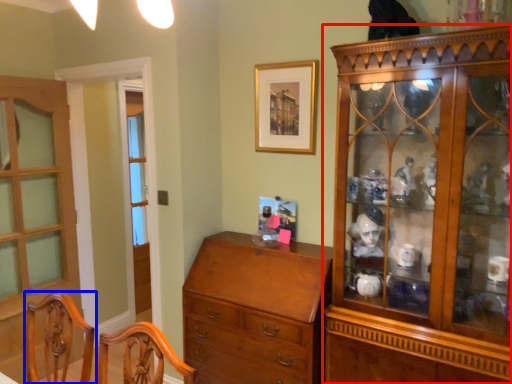
Question: Among these objects, which one is farthest to the camera, cabinetry (highlighted by a red box) or chair (highlighted by a blue box)?

Choices:
 (A) cabinetry
 (B) chair

Answer: (A)